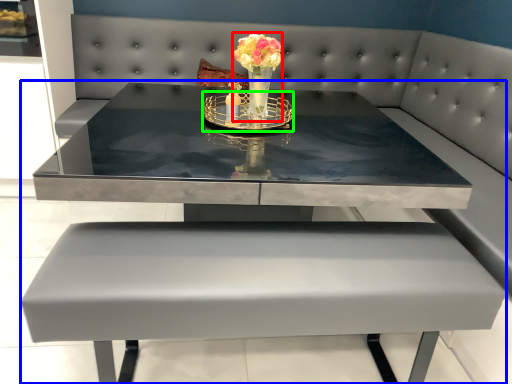
Question: Estimate the real-world distances between objects in this image. Which object is closer to floral arrangement (highlighted by a red box), table (highlighted by a blue box) or candle holder (highlighted by a green box)?

Choices:
 (A) table
 (B) candle holder

Answer: (B)